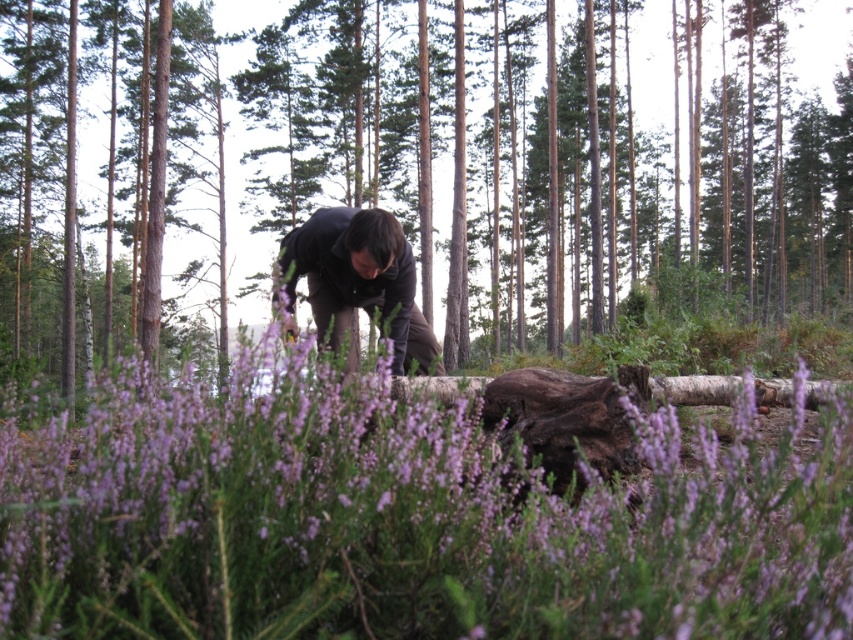
Is the position of brown rough log at center less distant than that of dark brown fabric at center?

No, it is not.

Is brown rough log at center thinner than dark brown fabric at center?

No.

Where is `brown rough log at center`? Image resolution: width=853 pixels, height=640 pixels. brown rough log at center is located at coordinates coord(560,157).

Does purple soft-textured flowers at center appear on the left side of dark brown fabric at center?

Incorrect, purple soft-textured flowers at center is not on the left side of dark brown fabric at center.

Can you confirm if purple soft-textured flowers at center is shorter than dark brown fabric at center?

Yes.

Where is `purple soft-textured flowers at center`? Image resolution: width=853 pixels, height=640 pixels. purple soft-textured flowers at center is located at coordinates (407, 518).

Is point (819, 195) in front of point (775, 481)?

That is False.

Which is above, brown rough log at center or purple soft-textured flowers at center?

brown rough log at center is above.

Measure the distance between brown rough log at center and camera.

brown rough log at center and camera are 5.74 feet apart from each other.

Identify the location of brown rough log at center. (560, 157).